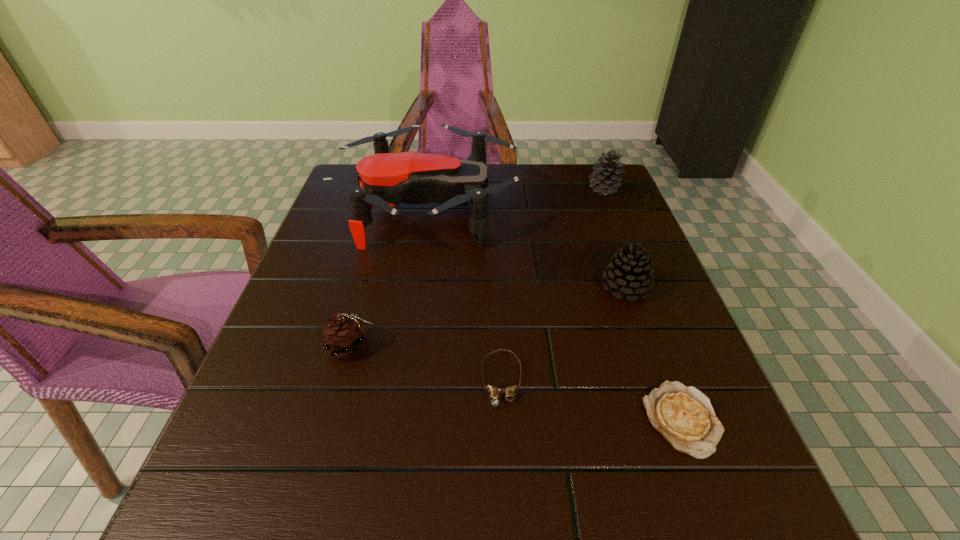
This screenshot has width=960, height=540. Identify the location of vacant space in between the farthest pinecone and the fourth nearest object. (614, 238).

Find the location of a particular element. blank region between the fourth nearest object and the shortest object is located at coordinates (654, 353).

Locate an element on the screen. free space between the drone and the goggles is located at coordinates (466, 293).

Find the location of a particular element. The height and width of the screenshot is (540, 960). blank region between the nearest pinecone and the farthest pinecone is located at coordinates (478, 268).

The image size is (960, 540). I want to click on object that is the nearest to the tallest object, so click(x=629, y=273).

Select which object is the third closest to the second shortest object. Please provide its 2D coordinates. Your answer should be formatted as a tuple, i.e. [(x, y)], where the tuple contains the x and y coordinates of a point satisfying the conditions above.

[(629, 273)]

You are a GUI agent. You are given a task and a screenshot of the screen. Output one action in this format:
    pyautogui.click(x=<x>, y=<y>)
    Task: Click on the third closest pinecone to the goggles
    The width and height of the screenshot is (960, 540).
    Given the screenshot: What is the action you would take?
    pyautogui.click(x=605, y=181)

At what (x,y) coordinates should I click in order to perform the action: click on pinecone that is the closest one to the farthest pinecone. Please return your answer as a coordinate pair (x, y). The image size is (960, 540). Looking at the image, I should click on (629, 273).

Image resolution: width=960 pixels, height=540 pixels. What are the coordinates of `vacant point that satisfies the following two spatial constraints: 1. on the camera side of the drone; 2. on the left side of the quiche` in the screenshot? It's located at (396, 419).

The width and height of the screenshot is (960, 540). Identify the location of vacant region that satisfies the following two spatial constraints: 1. on the back side of the shortest object; 2. with a leaf charm attached to the leftmost pinecone. (655, 347).